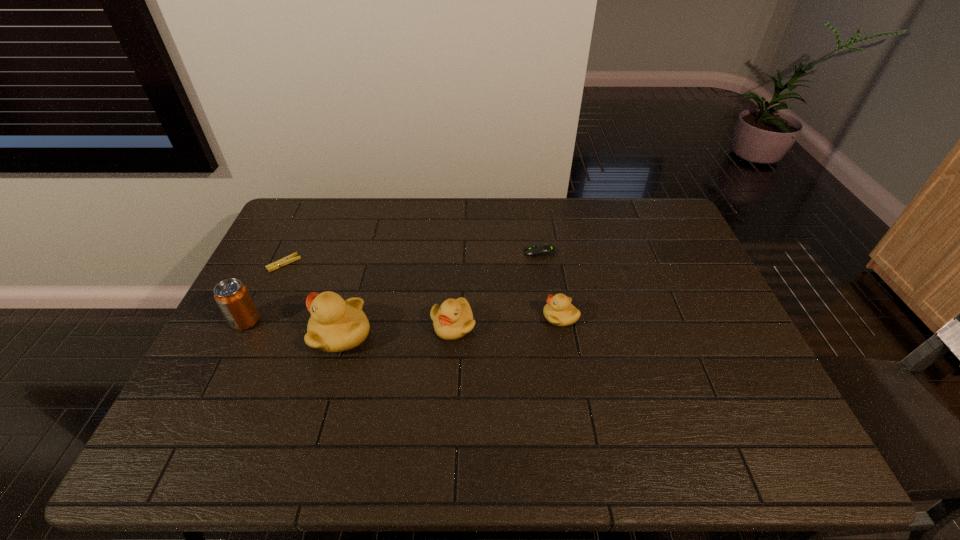
Locate an element on the screen. This screenshot has height=540, width=960. vacant space located on the right of the soda can is located at coordinates (306, 321).

Locate an element on the screen. clothespin that is at the left edge is located at coordinates [291, 258].

Find the location of a particular element. soda can at the left edge is located at coordinates click(232, 297).

What are the coordinates of `vacant space at the far edge` in the screenshot? It's located at (617, 238).

This screenshot has height=540, width=960. In the image, there is a desktop. What are the coordinates of `vacant area at the near edge` in the screenshot? It's located at (693, 410).

Find the location of `free space at the left edge of the desktop`. free space at the left edge of the desktop is located at coordinates (280, 288).

Find the location of `vacant region at the right edge`. vacant region at the right edge is located at coordinates (662, 241).

The height and width of the screenshot is (540, 960). What are the coordinates of `blank space at the far left corner of the desktop` in the screenshot? It's located at (307, 214).

Where is `vacant space at the near left corner`? The width and height of the screenshot is (960, 540). vacant space at the near left corner is located at coordinates (196, 414).

The width and height of the screenshot is (960, 540). In the image, there is a desktop. In order to click on free space at the near right corner in this screenshot , I will do `click(758, 396)`.